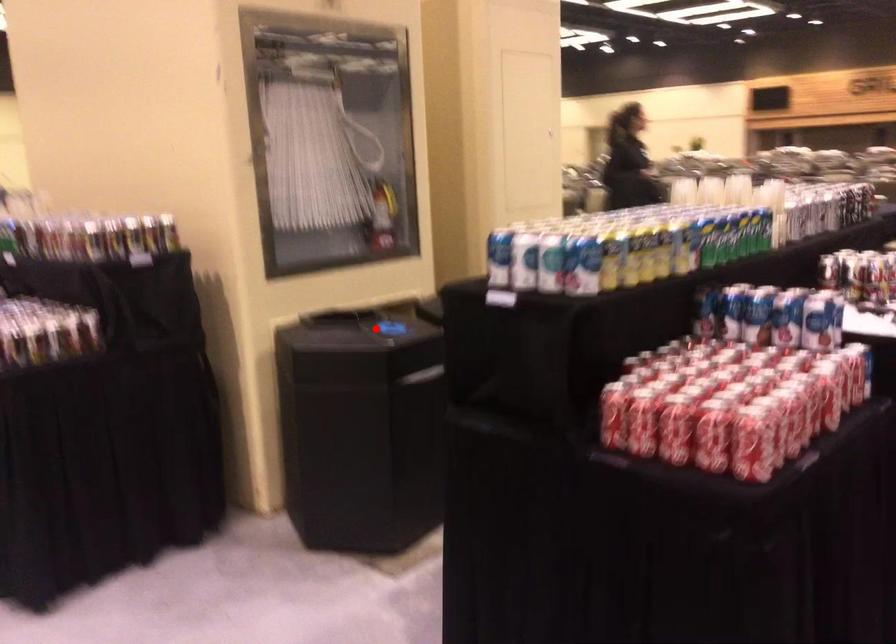
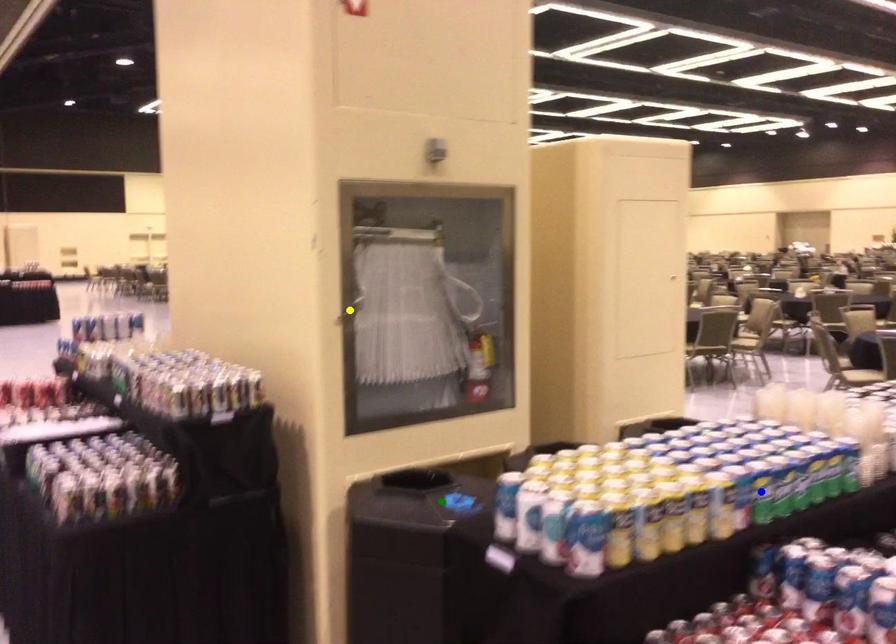
Question: I am providing you with two images of the same scene from different viewpoints. A red point is marked on the first image. You are given multiple points on the second image. In image 2, which mark is for the same physical point as the one in image 1?

Choices:
 (A) yellow point
 (B) blue point
 (C) green point

Answer: (C)